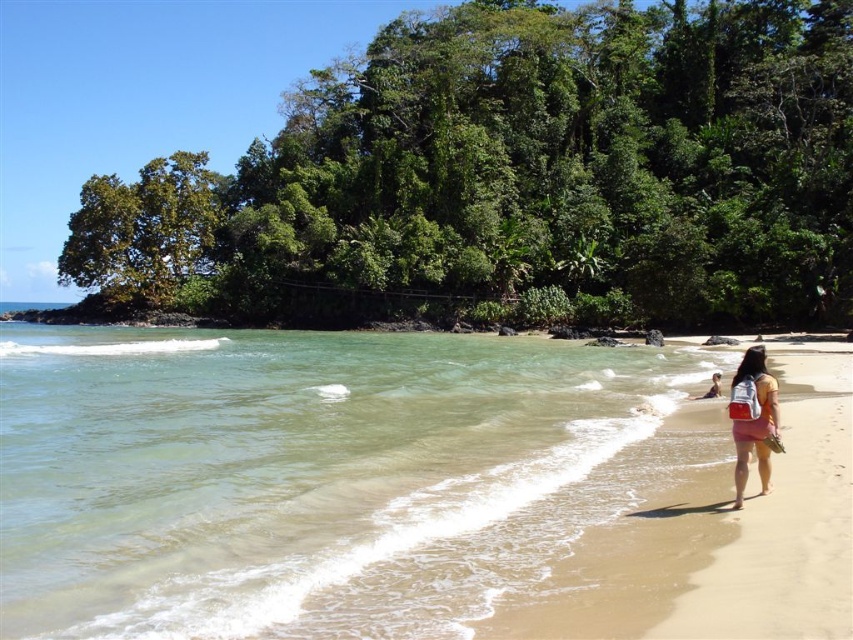
Image resolution: width=853 pixels, height=640 pixels. I want to click on matte pink shorts at lower right, so click(753, 419).

Is point (744, 355) closer to camera compared to point (703, 394)?

No, it is not.

Where is `matte pink shorts at lower right`? matte pink shorts at lower right is located at coordinates (753, 419).

Does clear water at beach right have a lesser width compared to matte pink shorts at lower right?

In fact, clear water at beach right might be wider than matte pink shorts at lower right.

Is clear water at beach right taller than matte pink shorts at lower right?

No, clear water at beach right is not taller than matte pink shorts at lower right.

Between point (432, 394) and point (744, 394), which one is positioned in front?

Point (744, 394)

Image resolution: width=853 pixels, height=640 pixels. Find the location of `clear water at beach right`. clear water at beach right is located at coordinates (312, 476).

This screenshot has width=853, height=640. Describe the element at coordinates (312, 476) in the screenshot. I see `clear water at beach right` at that location.

Who is more distant from viewer, (630, 449) or (820, 570)?

The point (630, 449) is more distant.

Who is more distant from viewer, (196,529) or (634,584)?

The point (196,529) is more distant.

Identify the location of clear water at beach right. (312, 476).